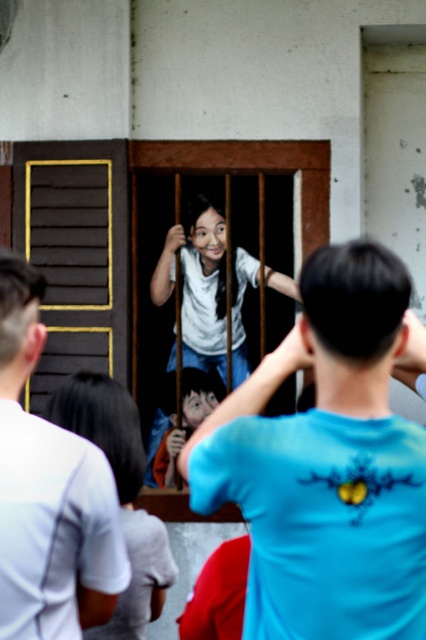
Question: Which of the following is the closest to the observer?

Choices:
 (A) (409, 556)
 (B) (204, 259)
 (C) (141, 444)

Answer: (A)

Question: Which is farther from the white matte shirt at upper left?

Choices:
 (A) smooth gray shirt at center
 (B) blue t-shirt at center
 (C) white matte shirt at center

Answer: (C)

Question: Can you confirm if white matte shirt at upper left is positioned to the right of smooth gray shirt at center?

Choices:
 (A) no
 (B) yes

Answer: (A)

Question: Can you confirm if blue t-shirt at center is smaller than white matte shirt at center?

Choices:
 (A) no
 (B) yes

Answer: (B)

Question: In this image, where is blue t-shirt at center located relative to smooth gray shirt at center?

Choices:
 (A) below
 (B) above

Answer: (B)

Question: Which is farther from the white matte shirt at upper left?

Choices:
 (A) white matte shirt at center
 (B) smooth gray shirt at center
 (C) blue t-shirt at center

Answer: (A)